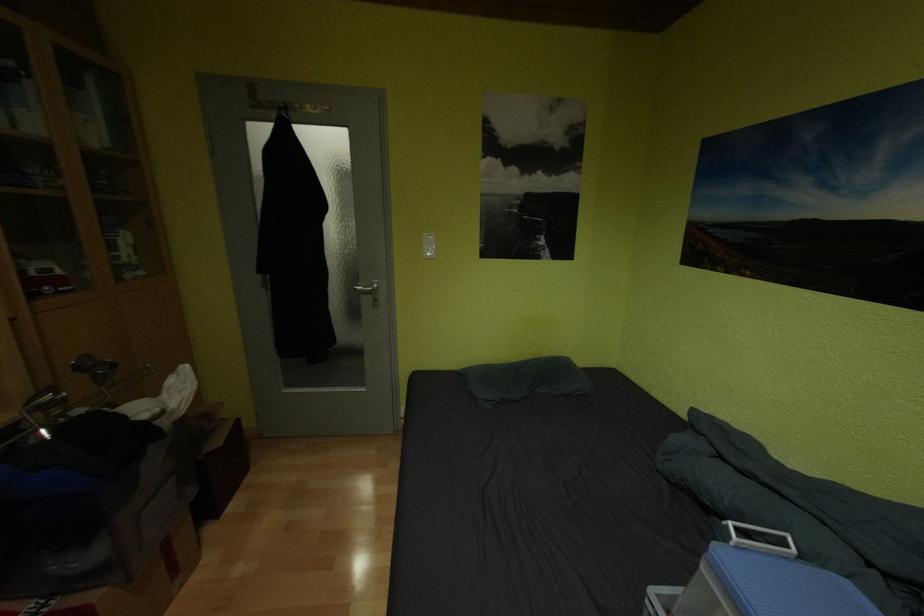
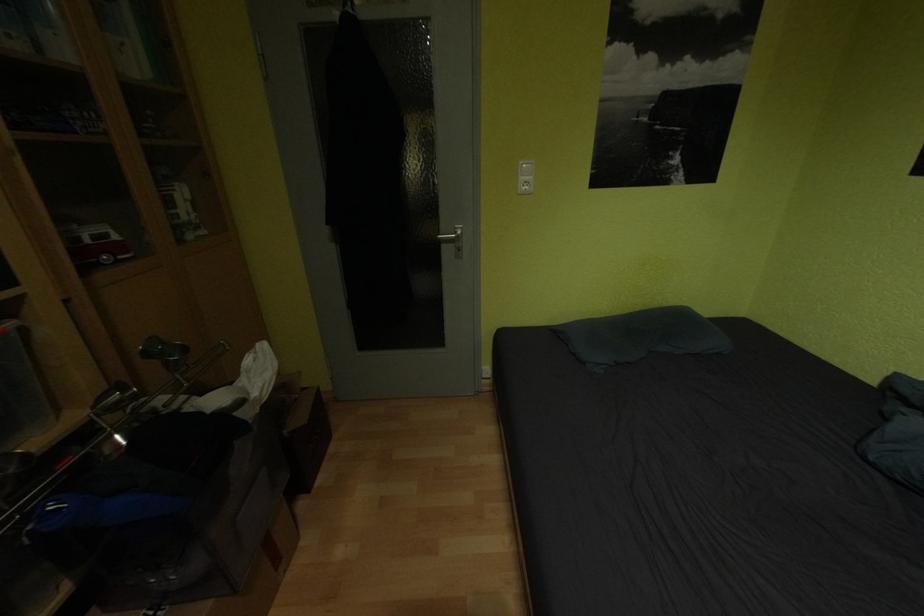
Question: The images are taken continuously from a first-person perspective. In which direction is your viewpoint rotating?

Choices:
 (A) Left
 (B) Right
 (C) Up
 (D) Down

Answer: (D)